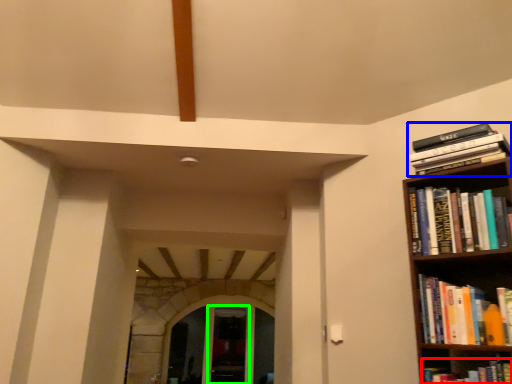
Question: Which object is positioned farthest from book (highlighted by a red box)? Select from book (highlighted by a blue box) and glass door (highlighted by a green box).

Choices:
 (A) book
 (B) glass door

Answer: (B)